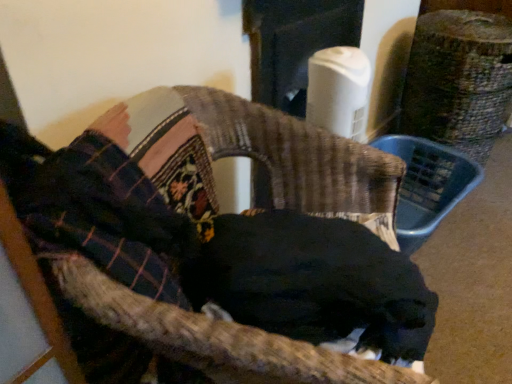
Question: Is woven fabric chair at center to the left or to the right of plaid fabric at upper left in the image?

Choices:
 (A) right
 (B) left

Answer: (A)

Question: Is woven fabric chair at center bigger or smaller than plaid fabric at upper left?

Choices:
 (A) big
 (B) small

Answer: (A)

Question: Based on their relative distances, which object is farther from the black fur dog at center?

Choices:
 (A) woven fabric chair at center
 (B) plaid fabric at upper left

Answer: (B)

Question: Based on their relative distances, which object is farther from the woven fabric chair at center?

Choices:
 (A) black fur dog at center
 (B) plaid fabric at upper left

Answer: (B)